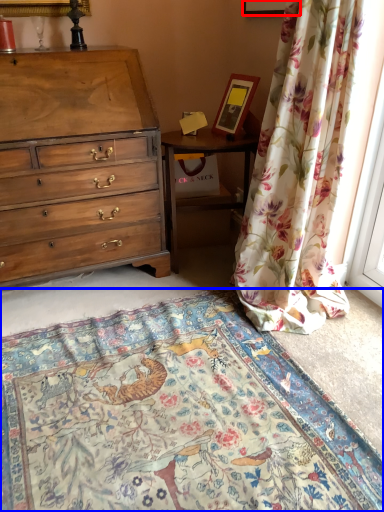
Question: Which object is closer to the camera taking this photo, picture frame (highlighted by a red box) or mat (highlighted by a blue box)?

Choices:
 (A) picture frame
 (B) mat

Answer: (B)